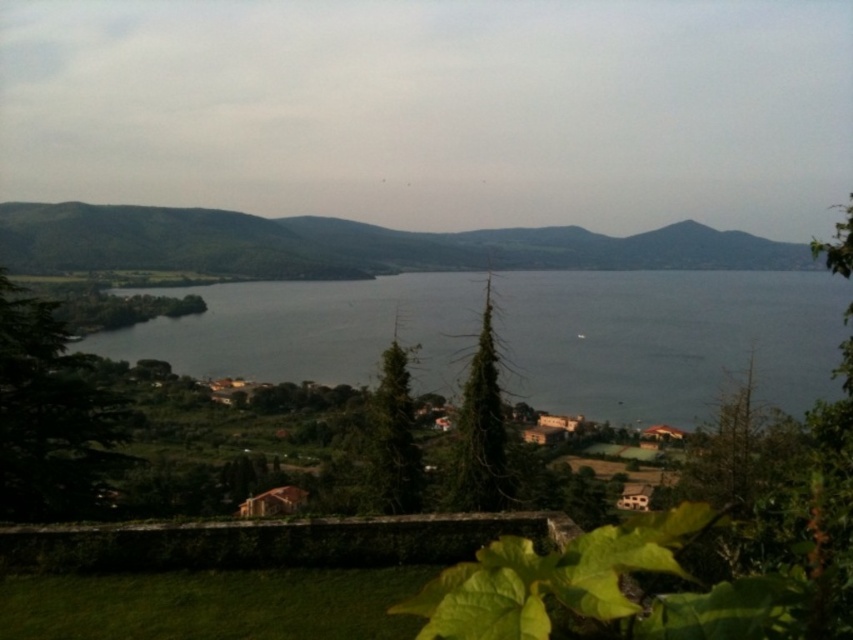
You are a photographer planning to capture the gray water at center and the green matte mountain at center in a single shot. Based on their sizes in the scene, which object should you focus on first to ensure both are in frame?

The gray water at center is smaller than the green matte mountain at center, so you should focus on the green matte mountain at center first to ensure both fit within the frame.

You are a hiker standing at the viewpoint overlooking the landscape. You see the gray water at center and the green matte mountain at center. Which object is closer to you?

The gray water at center is closer to you because it is in front of the green matte mountain at center.

You are standing at the viewpoint looking at the gray water at center and the green matte mountain at center. Which object appears taller in the scene?

The green matte mountain at center appears taller than the gray water at center.